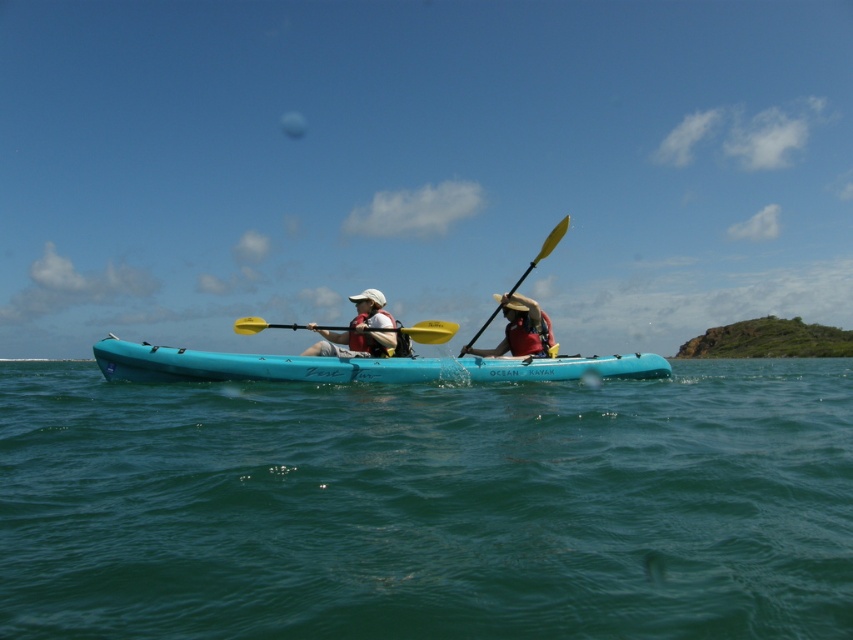
You are a kayaker planning to cross a 10 meter wide river. You see two points marked as point (228, 368). Can you safely cross the river using these points as your starting and ending positions?

The distance between the two points is 12.08 meters, which is wider than the 10 meter river. Therefore, you cannot safely cross the river using these points as your starting and ending positions.

You are a photographer trying to capture a clear shot of the matte white helmet at center while the teal rubber kayak at center is also in the frame. Based on their positions, will the kayak block the view of the helmet?

The teal rubber kayak at center is in front of matte white helmet at center, so it will block the view of the helmet.

Looking at this image, you are a photographer trying to capture a clear shot of the teal rubber kayak at center and the yellow plastic paddle at center. Since you want both objects in focus, which one should you adjust your camera focus on first?

The teal rubber kayak at center is closer to the viewer than the yellow plastic paddle at center, so you should focus on the teal rubber kayak at center first to ensure both are in focus.